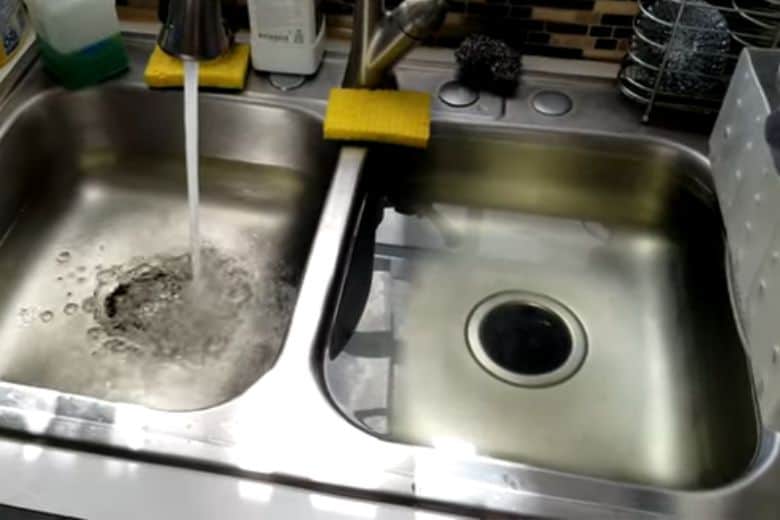
Image resolution: width=780 pixels, height=520 pixels. Identify the location of silver border around the sink. (285, 436).